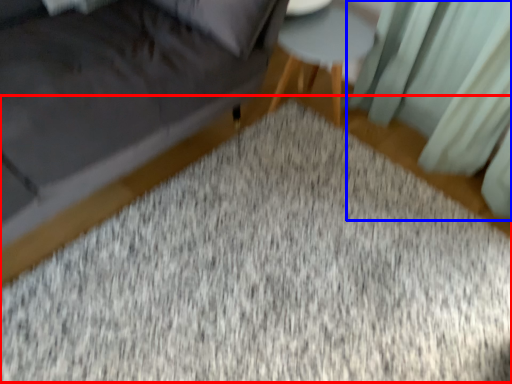
Question: Which object is closer to the camera taking this photo, mat (highlighted by a red box) or curtain (highlighted by a blue box)?

Choices:
 (A) mat
 (B) curtain

Answer: (A)